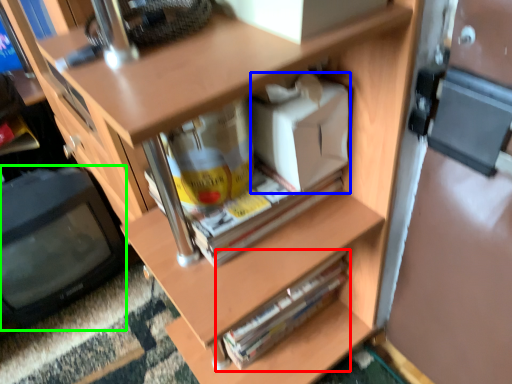
Question: Considering the real-world distances, which object is closest to paperback book (highlighted by a red box)? box (highlighted by a blue box) or computer monitor (highlighted by a green box).

Choices:
 (A) box
 (B) computer monitor

Answer: (A)